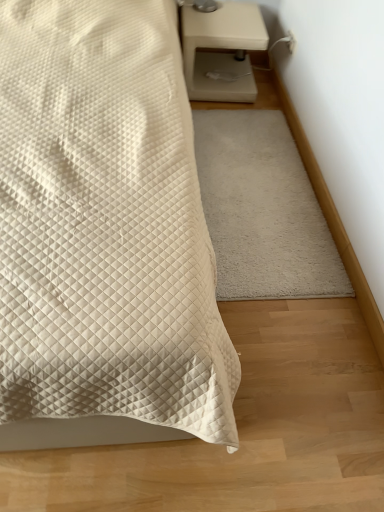
Question: From the image's perspective, does white quilted bed at center appear higher than white soft rug at center?

Choices:
 (A) no
 (B) yes

Answer: (B)

Question: Is white soft rug at center at the back of white quilted bed at center?

Choices:
 (A) no
 (B) yes

Answer: (A)

Question: Is white quilted bed at center to the right of white soft rug at center from the viewer's perspective?

Choices:
 (A) yes
 (B) no

Answer: (B)

Question: From a real-world perspective, is white quilted bed at center positioned under white soft rug at center based on gravity?

Choices:
 (A) yes
 (B) no

Answer: (B)

Question: Considering the relative sizes of white quilted bed at center and white soft rug at center in the image provided, is white quilted bed at center shorter than white soft rug at center?

Choices:
 (A) yes
 (B) no

Answer: (B)

Question: In the image, is beige matte nightstand at upper right on the left side or the right side of white quilted bed at center?

Choices:
 (A) left
 (B) right

Answer: (B)

Question: Is beige matte nightstand at upper right taller or shorter than white quilted bed at center?

Choices:
 (A) tall
 (B) short

Answer: (B)

Question: From a real-world perspective, is beige matte nightstand at upper right physically located above or below white quilted bed at center?

Choices:
 (A) below
 (B) above

Answer: (A)

Question: Considering the positions of beige matte nightstand at upper right and white quilted bed at center in the image, is beige matte nightstand at upper right wider or thinner than white quilted bed at center?

Choices:
 (A) wide
 (B) thin

Answer: (B)

Question: From a real-world perspective, relative to white soft rug at center, is beige matte nightstand at upper right vertically above or below?

Choices:
 (A) above
 (B) below

Answer: (A)

Question: In the image, is beige matte nightstand at upper right positioned in front of or behind white soft rug at center?

Choices:
 (A) front
 (B) behind

Answer: (B)

Question: Is point (193, 72) closer or farther from the camera than point (276, 207)?

Choices:
 (A) farther
 (B) closer

Answer: (A)

Question: Considering the positions of beige matte nightstand at upper right and white soft rug at center in the image, is beige matte nightstand at upper right taller or shorter than white soft rug at center?

Choices:
 (A) short
 (B) tall

Answer: (B)

Question: Considering the positions of white quilted bed at center and beige matte nightstand at upper right in the image, is white quilted bed at center wider or thinner than beige matte nightstand at upper right?

Choices:
 (A) thin
 (B) wide

Answer: (B)

Question: Relative to beige matte nightstand at upper right, is white quilted bed at center in front or behind?

Choices:
 (A) front
 (B) behind

Answer: (A)